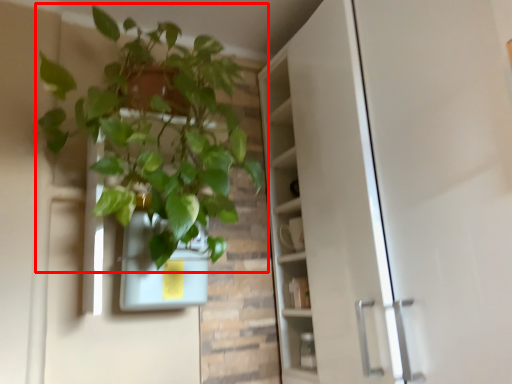
Question: Where is houseplant (annotated by the red box) located in relation to flowerpot in the image?

Choices:
 (A) left
 (B) right

Answer: (A)